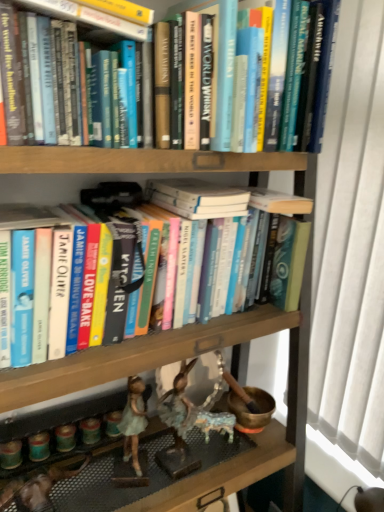
Question: From their relative heights in the image, would you say hardcover book at center, which is counted as the third book, starting from the top, is taller or shorter than matte green figurine at lower left?

Choices:
 (A) short
 (B) tall

Answer: (A)

Question: From a real-world perspective, is hardcover book at center, which is counted as the third book, starting from the top, physically located above or below matte green figurine at lower left?

Choices:
 (A) above
 (B) below

Answer: (A)

Question: Considering the real-world distances, which object is closest to the matte green figurine at lower left?

Choices:
 (A) hardcover book at upper center, the second book positioned from the top
 (B) hardcover book at center, which is counted as the third book, starting from the top
 (C) hardcover book at upper center, which is counted as the first book, starting from the top
 (D) white fabric at right

Answer: (B)

Question: Which object is positioned farthest from the matte green figurine at lower left?

Choices:
 (A) white fabric at right
 (B) hardcover book at center, the first book from the bottom
 (C) hardcover book at upper center, the second book positioned from the top
 (D) hardcover book at upper center, which is counted as the first book, starting from the top

Answer: (D)